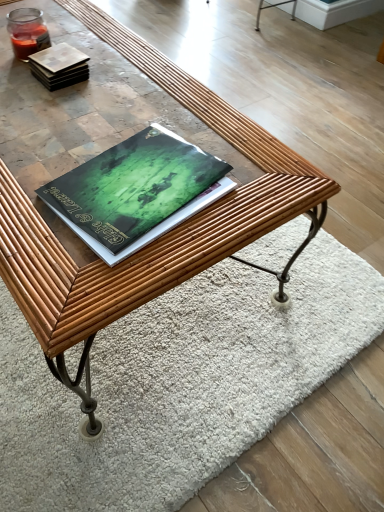
Find the location of a particular element. The width and height of the screenshot is (384, 512). free space above green matte book at center, acting as the second book starting from the back (from a real-world perspective) is located at coordinates (141, 179).